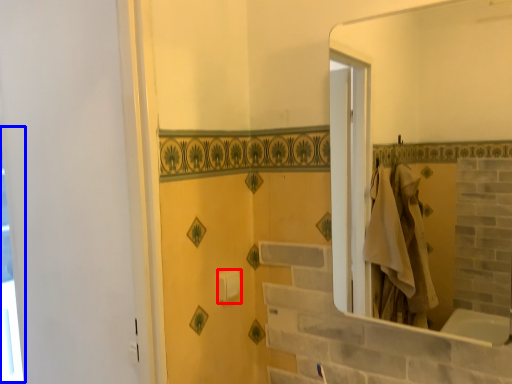
Question: Which of the following is the farthest to the observer, towel bar (highlighted by a red box) or window (highlighted by a blue box)?

Choices:
 (A) towel bar
 (B) window

Answer: (B)